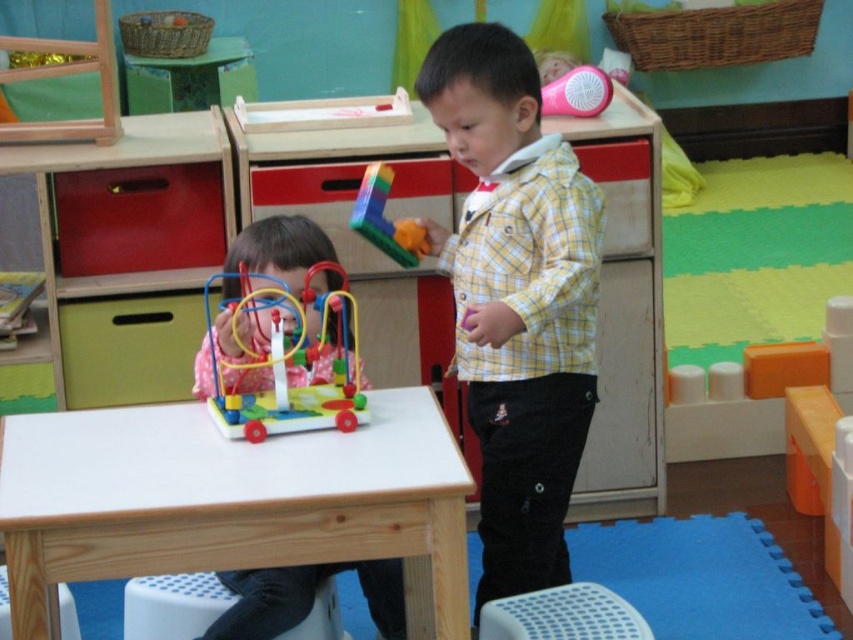
You are a parent trying to place a small toy between the white plastic stool at lower center and the white plastic stool at lower left. Which stool is closer to you to ensure the toy is placed in the right spot?

The white plastic stool at lower center is closer to you, so place the toy near it to position it correctly between the two stools.

You are a parent trying to choose seating for your child in the playroom. You have two options available, the white perforated stool at lower center and the pink plastic fan at upper center. Based on their sizes, which one would be more suitable as seating?

The white perforated stool at lower center is more suitable as seating because its width is larger than the pink plastic fan at upper center, making it more stable and comfortable for a child to sit on.